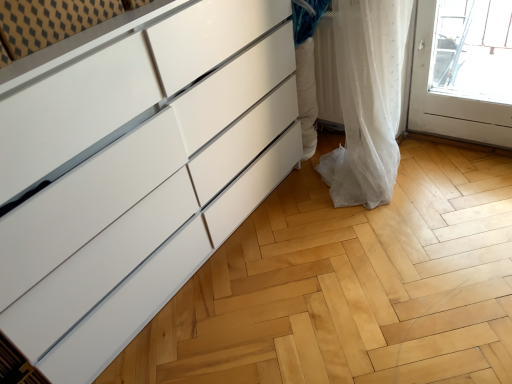
Locate an element on the screen. The height and width of the screenshot is (384, 512). free point to the right of white sheer curtain at lower right is located at coordinates (446, 160).